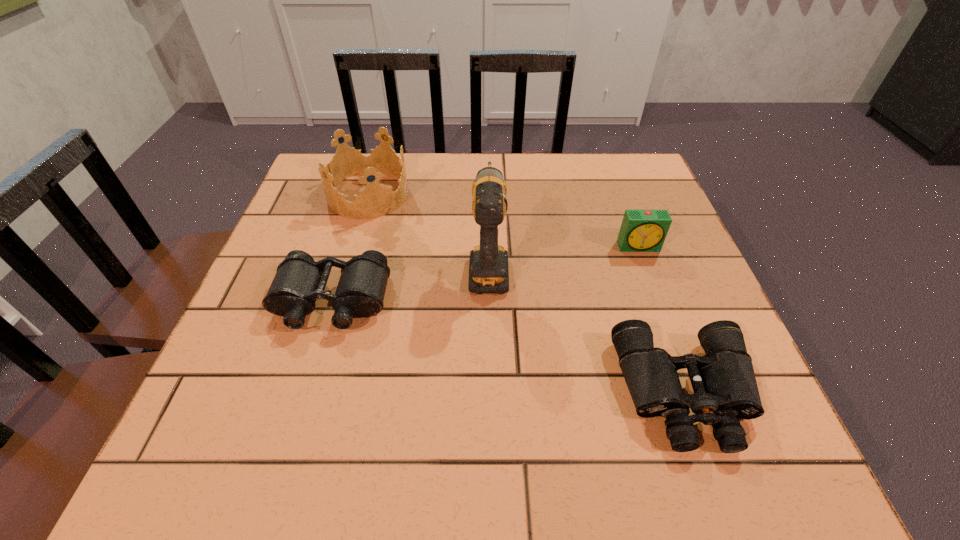
Where is `object that is positioned at the far left corner`? The height and width of the screenshot is (540, 960). object that is positioned at the far left corner is located at coordinates (375, 200).

Identify the location of object located at the near right corner. (725, 389).

What are the coordinates of `free space at the far edge of the desktop` in the screenshot? It's located at (497, 158).

Find the location of a particular element. Image resolution: width=960 pixels, height=540 pixels. free space at the near edge of the desktop is located at coordinates (618, 456).

The width and height of the screenshot is (960, 540). In the image, there is a desktop. Identify the location of vacant space at the left edge. pos(299,372).

The width and height of the screenshot is (960, 540). In the image, there is a desktop. In order to click on vacant space at the right edge in this screenshot , I will do `click(664, 311)`.

What are the coordinates of `vacant space at the far left corner` in the screenshot? It's located at (312, 190).

In the image, there is a desktop. Identify the location of free space at the near left corner. The width and height of the screenshot is (960, 540). (215, 450).

Where is `vacant space at the far right corner of the desktop`? This screenshot has width=960, height=540. vacant space at the far right corner of the desktop is located at coordinates (599, 180).

Find the location of a particular element. The image size is (960, 540). unoccupied position between the nearer binoculars and the tallest object is located at coordinates point(588,329).